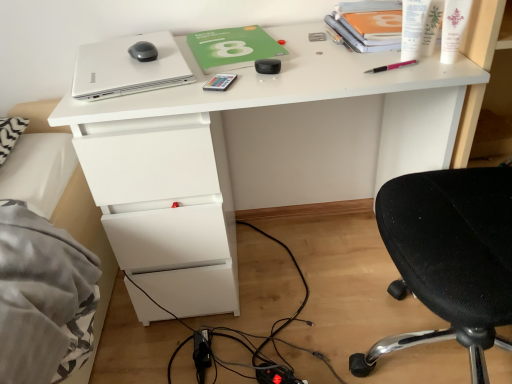
Question: Does metallic rectangular object at center, which is the fourth stationery in right-to-left order, have a greater width compared to silver metallic laptop at upper left?

Choices:
 (A) yes
 (B) no

Answer: (B)

Question: Is metallic rectangular object at center, the 1th stationery in the left-to-right sequence, completely or partially outside of silver metallic laptop at upper left?

Choices:
 (A) yes
 (B) no

Answer: (A)

Question: Is metallic rectangular object at center, which is the fourth stationery in right-to-left order, at the left side of silver metallic laptop at upper left?

Choices:
 (A) no
 (B) yes

Answer: (A)

Question: Does metallic rectangular object at center, the 1th stationery in the left-to-right sequence, have a greater height compared to silver metallic laptop at upper left?

Choices:
 (A) yes
 (B) no

Answer: (B)

Question: Does metallic rectangular object at center, which is the fourth stationery in right-to-left order, contain silver metallic laptop at upper left?

Choices:
 (A) yes
 (B) no

Answer: (B)

Question: From the image's perspective, is metallic rectangular object at center, which is the fourth stationery in right-to-left order, located above silver metallic laptop at upper left?

Choices:
 (A) yes
 (B) no

Answer: (B)

Question: Does white glossy cream at upper right lie in front of white glossy desk at center?

Choices:
 (A) yes
 (B) no

Answer: (A)

Question: Is white glossy cream at upper right aimed at white glossy desk at center?

Choices:
 (A) yes
 (B) no

Answer: (B)

Question: From the image's perspective, does white glossy cream at upper right appear higher than white glossy desk at center?

Choices:
 (A) no
 (B) yes

Answer: (B)

Question: Can you confirm if white glossy cream at upper right is thinner than white glossy desk at center?

Choices:
 (A) no
 (B) yes

Answer: (B)

Question: From a real-world perspective, is white glossy cream at upper right over white glossy desk at center?

Choices:
 (A) yes
 (B) no

Answer: (A)

Question: Does white glossy cream at upper right contain white glossy desk at center?

Choices:
 (A) no
 (B) yes

Answer: (A)

Question: Considering the relative positions of white plastic pen at upper right, the 3th stationery when ordered from left to right, and silver metallic laptop at upper left in the image provided, is white plastic pen at upper right, the 3th stationery when ordered from left to right, to the right of silver metallic laptop at upper left from the viewer's perspective?

Choices:
 (A) yes
 (B) no

Answer: (A)